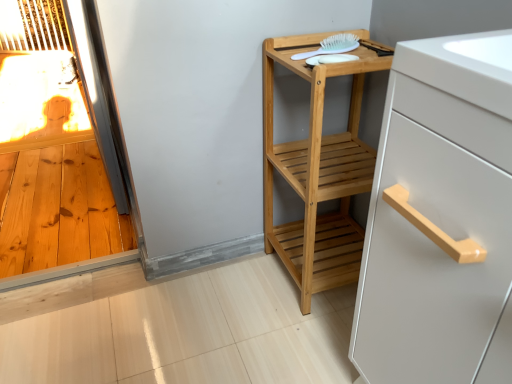
Question: Is white plastic brush at upper right inside the boundaries of white matte cabinet handle at upper right, or outside?

Choices:
 (A) outside
 (B) inside

Answer: (A)

Question: In terms of size, does white plastic brush at upper right appear bigger or smaller than white matte cabinet handle at upper right?

Choices:
 (A) small
 (B) big

Answer: (A)

Question: Which is farther from the white matte cabinet handle at upper right?

Choices:
 (A) natural wood shelf at center
 (B) white plastic brush at upper right

Answer: (B)

Question: Considering the real-world distances, which object is farthest from the natural wood shelf at center?

Choices:
 (A) white plastic brush at upper right
 (B) white matte cabinet handle at upper right

Answer: (B)